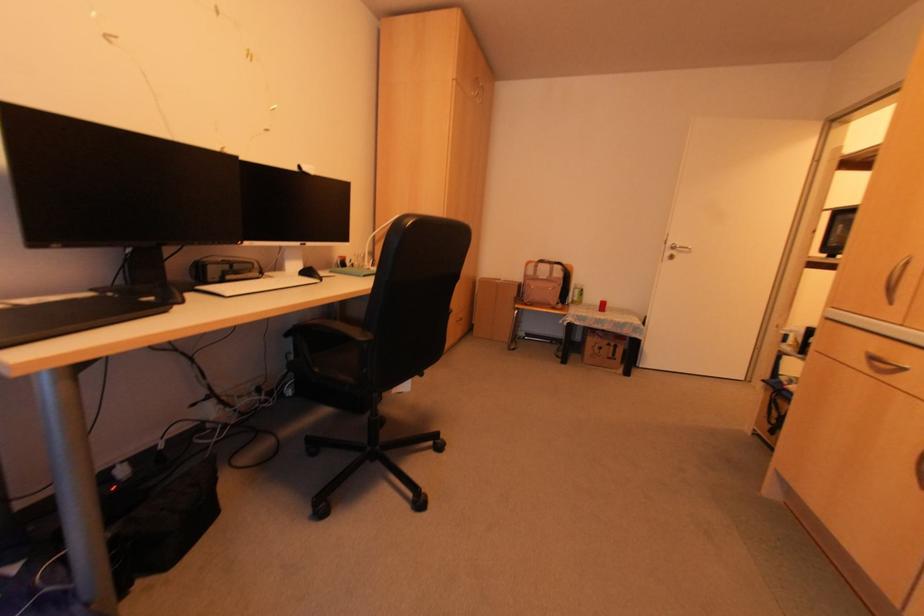
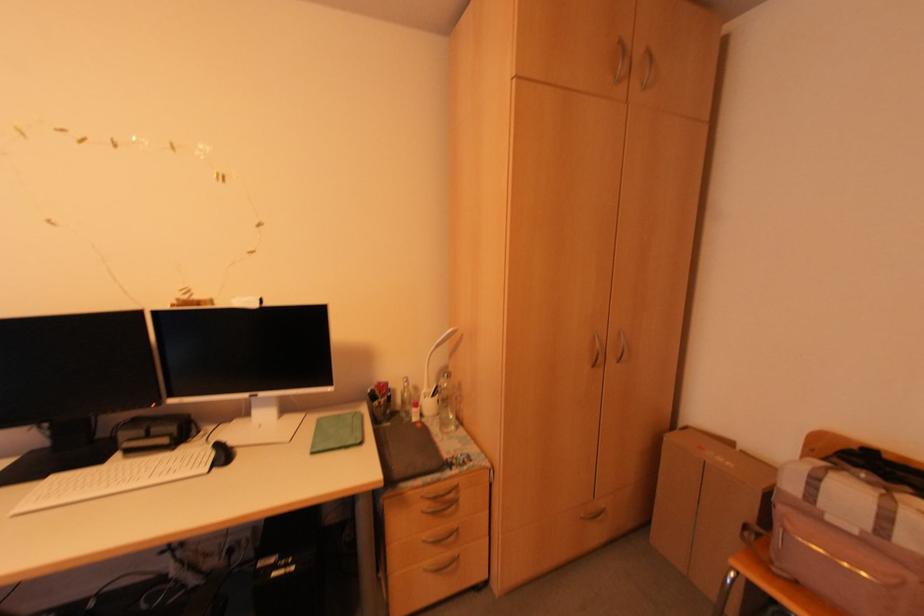
The point at (542,278) is marked in the first image. Where is the corresponding point in the second image?

(854, 532)